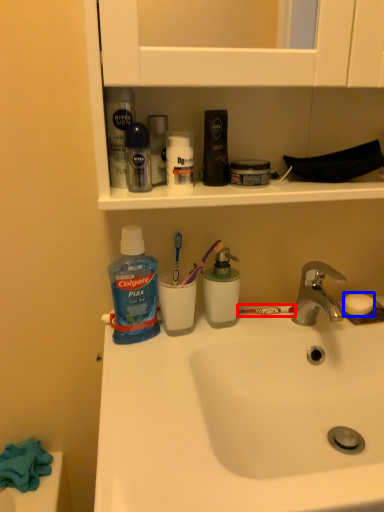
Question: Which object is closer to the camera taking this photo, toothbrush (highlighted by a red box) or soap (highlighted by a blue box)?

Choices:
 (A) toothbrush
 (B) soap

Answer: (B)